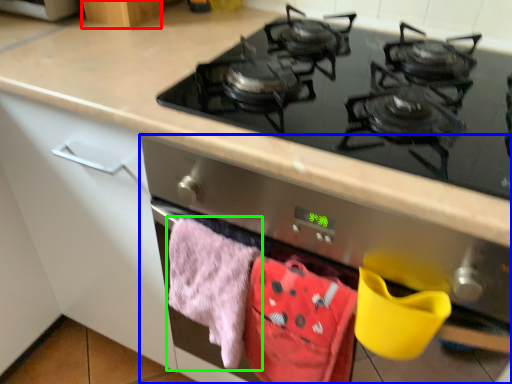
Question: Which object is the farthest from cabinetry (highlighted by a red box)? Choose among these: oven (highlighted by a blue box) or beach towel (highlighted by a green box).

Choices:
 (A) oven
 (B) beach towel

Answer: (A)